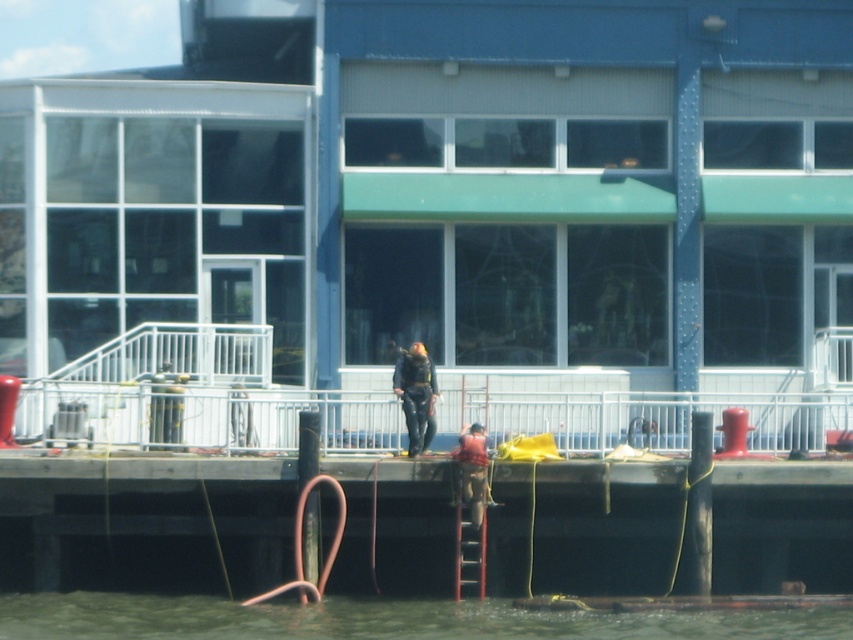
Question: Which of the following is the farthest from the observer?

Choices:
 (A) (68, 595)
 (B) (289, 440)
 (C) (473, 424)

Answer: (B)

Question: Can you confirm if greenish water at lower center is smaller than black rubber suit at center?

Choices:
 (A) no
 (B) yes

Answer: (B)

Question: Is the position of greenish water at lower center less distant than that of red plaid shirt at center?

Choices:
 (A) no
 (B) yes

Answer: (B)

Question: Which point is closer to the camera?

Choices:
 (A) greenish water at lower center
 (B) metallic red ladder at center
 (C) red plaid shirt at center
 (D) white metal railing at center

Answer: (A)

Question: Does greenish water at lower center appear on the left side of red plaid shirt at center?

Choices:
 (A) no
 (B) yes

Answer: (B)

Question: Among these objects, which one is nearest to the camera?

Choices:
 (A) black rubber suit at center
 (B) white metal railing at center
 (C) red plaid shirt at center
 (D) metallic red ladder at center

Answer: (C)